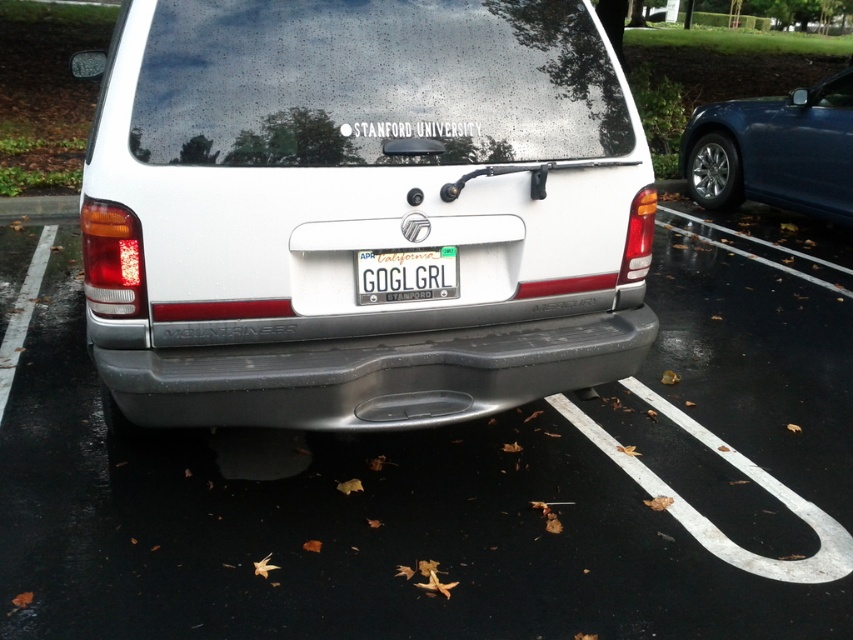
Which is in front, point (132, 506) or point (564, 372)?

Point (564, 372) is in front.

Can you confirm if white matte vehicle at center is smaller than gray matte bumper at center?

Actually, white matte vehicle at center might be larger than gray matte bumper at center.

Is point (339, 536) closer to viewer compared to point (236, 419)?

No, it is behind (236, 419).

Where is `white matte vehicle at center`? This screenshot has width=853, height=640. white matte vehicle at center is located at coordinates (462, 484).

Which is more to the left, glossy blue sedan at right or white plastic license plate at center?

white plastic license plate at center

Is point (752, 97) positioned after point (364, 291)?

Yes, point (752, 97) is behind point (364, 291).

Is point (711, 148) positioned after point (395, 276)?

Yes, it is.

You are a GUI agent. You are given a task and a screenshot of the screen. Output one action in this format:
    pyautogui.click(x=<x>, y=<y>)
    Task: Click on the glossy blue sedan at right
    The width and height of the screenshot is (853, 640).
    Given the screenshot: What is the action you would take?
    pyautogui.click(x=775, y=150)

Does white matte van at center lie in front of glossy blue sedan at right?

Yes, it is in front of glossy blue sedan at right.

Does point (181, 90) come in front of point (842, 182)?

Yes, point (181, 90) is closer to viewer.

Locate an element on the screen. This screenshot has height=640, width=853. white matte van at center is located at coordinates (360, 211).

The image size is (853, 640). Identify the location of white matte van at center. (360, 211).